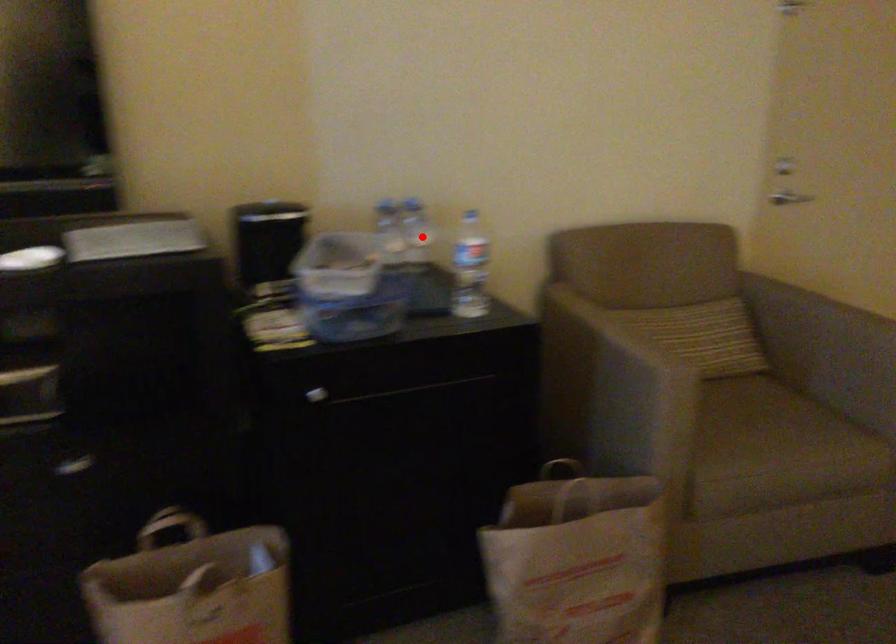
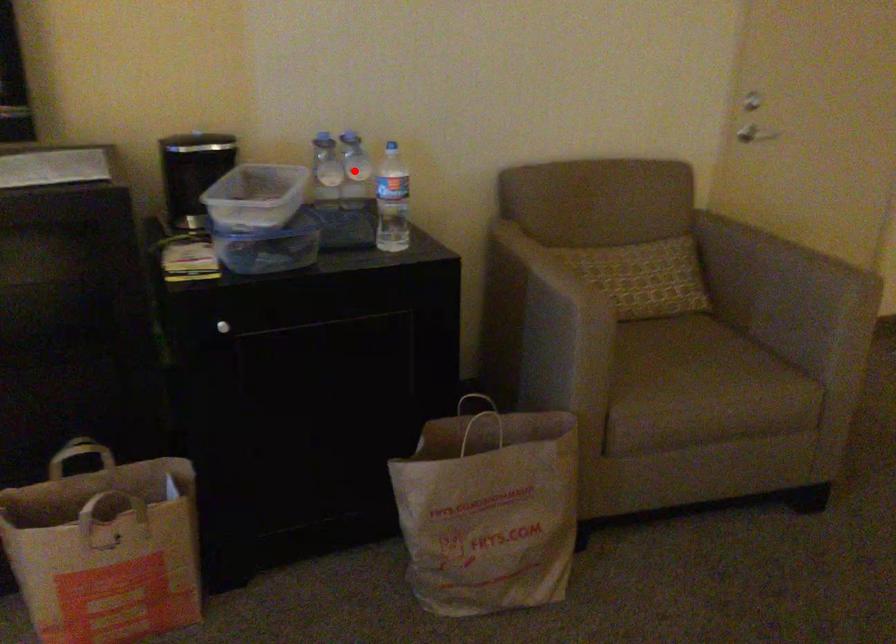
I am providing you with two images of the same scene from different viewpoints. A red point is marked on the first image and another point is marked on the second image. Are the points marked in image1 and image2 representing the same 3D position?

Yes